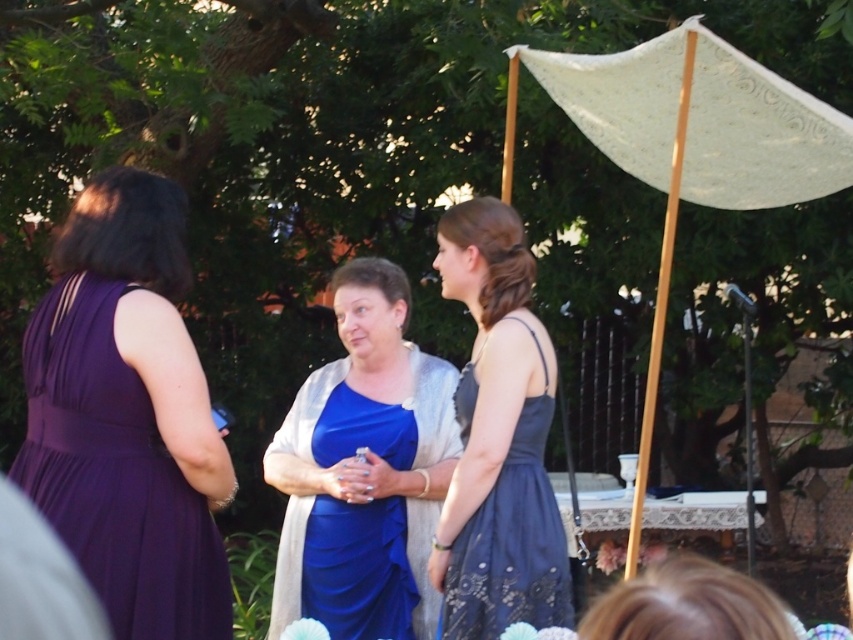
Question: Does matte blue dress at center appear over white lace canopy at upper right?

Choices:
 (A) yes
 (B) no

Answer: (B)

Question: Can you confirm if matte blue dress at center is positioned to the right of white lace canopy at upper right?

Choices:
 (A) no
 (B) yes

Answer: (A)

Question: Which point is closer to the camera?

Choices:
 (A) (91, 337)
 (B) (757, 86)
 (C) (554, 566)
 (D) (344, 372)

Answer: (A)

Question: Which object is closer to the camera taking this photo?

Choices:
 (A) white lace canopy at upper right
 (B) purple satin dress at left

Answer: (B)

Question: Among these points, which one is nearest to the camera?

Choices:
 (A) (761, 113)
 (B) (457, 582)
 (C) (108, 304)

Answer: (C)

Question: Where is purple satin dress at left located in relation to navy lace dress at center in the image?

Choices:
 (A) below
 (B) above

Answer: (B)